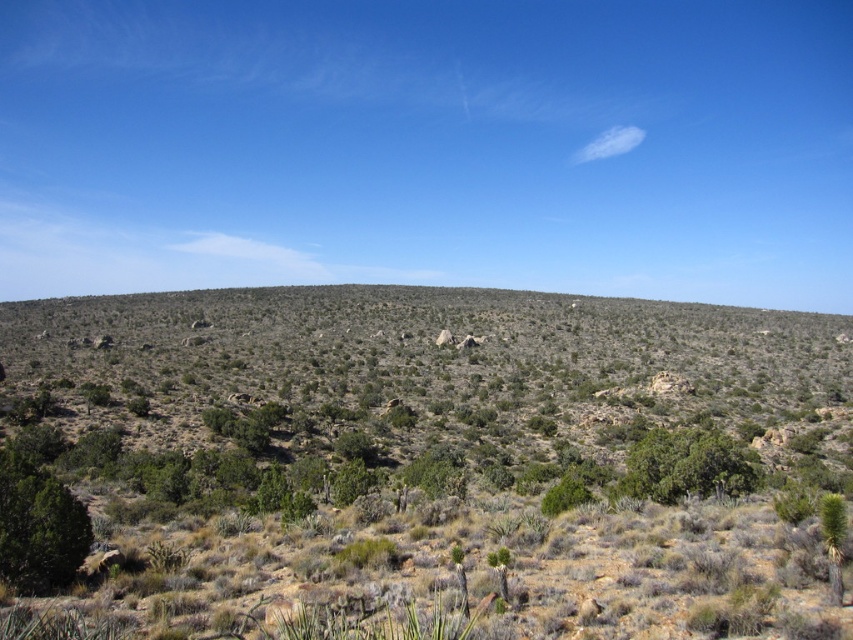
You are a hiker trying to navigate through the desert. You see the green shrubs at center and the green leafy shrub at lower right. Which shrub would you consider as a better indicator of water availability, and why?

The green shrubs at center is a better indicator of water availability because it has a larger size compared to the green leafy shrub at lower right, suggesting more consistent access to water in that area.

You are a hiker carrying a 50 feet long rope. You spot a green leafy shrub at lower right and a green leafy bush at center. Can you use the rope to connect them without moving either of them?

The distance between the green leafy shrub at lower right and the green leafy bush at center is 40.25 feet. Since the rope is 50 feet long, which is longer than the distance between them, you can connect them without moving either of them.

You are navigating a drone through the desert landscape shown in the image. You need to fly from point A to point B. Given that point A is at coordinate point (206, 294) and point B is at coordinate point (683, 474), will you pass over any obstacles between them?

Point (206, 294) is behind point (683, 474), so the drone will not pass over any obstacles between them as the path is clear.